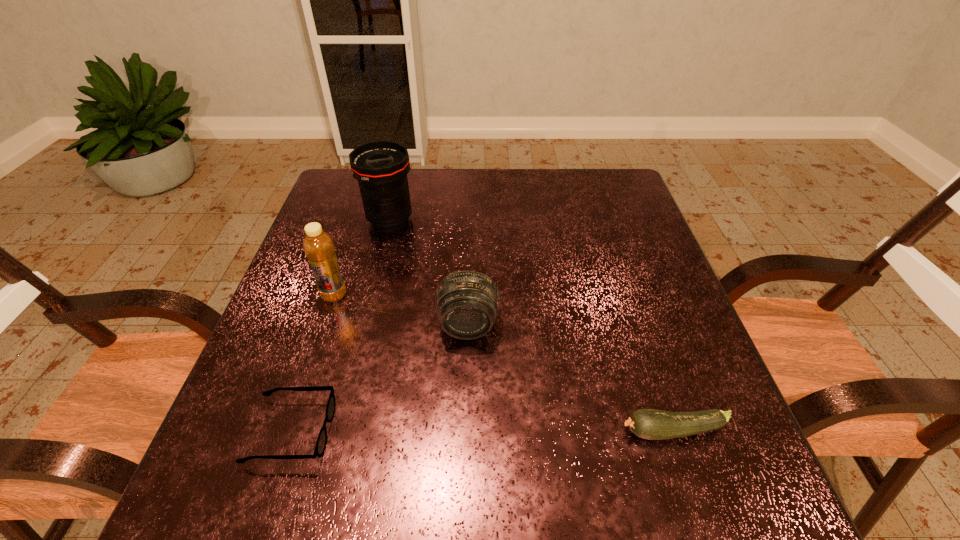
This screenshot has height=540, width=960. What are the coordinates of `blank region between the nearer telephoto lens and the spectacles` in the screenshot? It's located at (380, 378).

At what (x,y) coordinates should I click in order to perform the action: click on vacant area that lies between the farthest object and the zucchini. Please return your answer as a coordinate pair (x, y). Looking at the image, I should click on (531, 326).

In order to click on free space that is in between the second object from right to left and the farther telephoto lens in this screenshot , I will do `click(429, 273)`.

Identify the location of empty space that is in between the taller telephoto lens and the third nearest object. (429, 273).

At what (x,y) coordinates should I click in order to perform the action: click on free spot between the bottle and the shortest object. Please return your answer as a coordinate pair (x, y). Looking at the image, I should click on point(313,363).

You are a GUI agent. You are given a task and a screenshot of the screen. Output one action in this format:
    pyautogui.click(x=<x>, y=<y>)
    Task: Click on the free space that is in between the nearer telephoto lens and the spectacles
    This screenshot has width=960, height=540.
    Given the screenshot: What is the action you would take?
    pyautogui.click(x=380, y=378)

Identify the location of empty space between the nearer telephoto lens and the rightmost object. (570, 378).

You are a GUI agent. You are given a task and a screenshot of the screen. Output one action in this format:
    pyautogui.click(x=<x>, y=<y>)
    Task: Click on the vacant region between the taller telephoto lens and the fourth nearest object
    This screenshot has height=540, width=960.
    Given the screenshot: What is the action you would take?
    pyautogui.click(x=362, y=258)

The width and height of the screenshot is (960, 540). I want to click on vacant area between the taller telephoto lens and the shorter telephoto lens, so click(429, 273).

Locate which object is the closest to the shortest object. Please provide its 2D coordinates. Your answer should be formatted as a tuple, i.e. [(x, y)], where the tuple contains the x and y coordinates of a point satisfying the conditions above.

[(467, 302)]